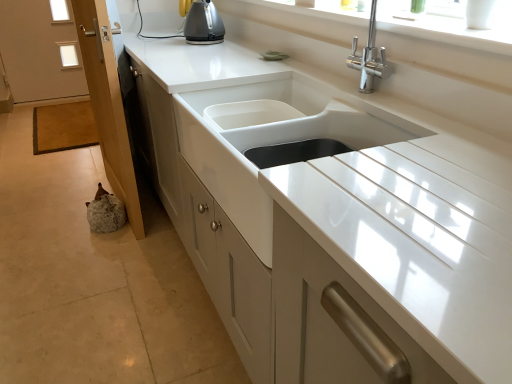
The height and width of the screenshot is (384, 512). What do you see at coordinates (108, 104) in the screenshot?
I see `wooden screen door at lower left` at bounding box center [108, 104].

Where is `wooden screen door at lower left`? The height and width of the screenshot is (384, 512). wooden screen door at lower left is located at coordinates (108, 104).

Describe the element at coordinates (270, 139) in the screenshot. I see `white glossy sink at center` at that location.

Locate an element on the screen. Image resolution: width=512 pixels, height=384 pixels. white glossy sink at center is located at coordinates (270, 139).

What is the approximate width of white glossy sink at center?

20.01 inches.

Image resolution: width=512 pixels, height=384 pixels. Identify the location of wooden screen door at lower left. coord(108,104).

Considering the positions of objects white glossy sink at center and wooden screen door at lower left in the image provided, who is more to the right, white glossy sink at center or wooden screen door at lower left?

white glossy sink at center is more to the right.

Does white glossy sink at center lie in front of wooden screen door at lower left?

Yes, white glossy sink at center is closer to the viewer.

Which point is more forward, (x=359, y=141) or (x=95, y=86)?

The point (x=359, y=141) is in front.

From the image's perspective, which is above, white glossy sink at center or wooden screen door at lower left?

wooden screen door at lower left is shown above in the image.

From a real-world perspective, who is located lower, white glossy sink at center or wooden screen door at lower left?

wooden screen door at lower left, from a real-world perspective.

Which object is wider, white glossy sink at center or wooden screen door at lower left?

white glossy sink at center is wider.

Can you confirm if white glossy sink at center is shorter than wooden screen door at lower left?

Correct, white glossy sink at center is not as tall as wooden screen door at lower left.

Considering the relative sizes of white glossy sink at center and wooden screen door at lower left in the image provided, is white glossy sink at center bigger than wooden screen door at lower left?

No, white glossy sink at center is not bigger than wooden screen door at lower left.

Is white glossy sink at center outside of wooden screen door at lower left?

Absolutely, white glossy sink at center is external to wooden screen door at lower left.

Is there a large distance between white glossy sink at center and wooden screen door at lower left?

That's not correct — white glossy sink at center is a little close to wooden screen door at lower left.

Is white glossy sink at center facing away from wooden screen door at lower left?

No.

How many degrees apart are the facing directions of white glossy sink at center and wooden screen door at lower left?

2.02 degrees separate the facing orientations of white glossy sink at center and wooden screen door at lower left.

The width and height of the screenshot is (512, 384). What are the coordinates of `sink that is on the right side of wooden screen door at lower left` in the screenshot? It's located at (270, 139).

Considering the relative positions of wooden screen door at lower left and white glossy sink at center in the image provided, is wooden screen door at lower left to the left or to the right of white glossy sink at center?

In the image, wooden screen door at lower left appears on the left side of white glossy sink at center.

Does wooden screen door at lower left come behind white glossy sink at center?

Yes, wooden screen door at lower left is behind white glossy sink at center.

Considering the positions of points (131, 170) and (252, 209), is point (131, 170) closer to camera compared to point (252, 209)?

No, (131, 170) is behind (252, 209).

From the image's perspective, does wooden screen door at lower left appear lower than white glossy sink at center?

No, from the image's perspective, wooden screen door at lower left is not below white glossy sink at center.

From a real-world perspective, is wooden screen door at lower left below white glossy sink at center?

Yes, from a real-world perspective, wooden screen door at lower left is below white glossy sink at center.

Considering the relative sizes of wooden screen door at lower left and white glossy sink at center in the image provided, is wooden screen door at lower left thinner than white glossy sink at center?

Yes, wooden screen door at lower left is thinner than white glossy sink at center.

Considering the sizes of wooden screen door at lower left and white glossy sink at center in the image, is wooden screen door at lower left taller or shorter than white glossy sink at center?

In the image, wooden screen door at lower left appears to be taller than white glossy sink at center.

Can you confirm if wooden screen door at lower left is smaller than white glossy sink at center?

Incorrect, wooden screen door at lower left is not smaller in size than white glossy sink at center.

Would you say wooden screen door at lower left is outside white glossy sink at center?

wooden screen door at lower left lies outside white glossy sink at center's area.

Is wooden screen door at lower left with white glossy sink at center?

They are not placed beside each other.

Could you tell me if wooden screen door at lower left is facing white glossy sink at center?

No, wooden screen door at lower left is not oriented towards white glossy sink at center.

How distant is wooden screen door at lower left from white glossy sink at center?

wooden screen door at lower left and white glossy sink at center are 34.12 inches apart from each other.

You are a GUI agent. You are given a task and a screenshot of the screen. Output one action in this format:
    pyautogui.click(x=<x>, y=<y>)
    Task: Click on the sink located above the wooden screen door at lower left (from a real-world perspective)
    
    Given the screenshot: What is the action you would take?
    pyautogui.click(x=270, y=139)

I want to click on screen door located on the left of white glossy sink at center, so click(x=108, y=104).

Find the location of `screen door above the white glossy sink at center (from the image's perspective)`. screen door above the white glossy sink at center (from the image's perspective) is located at coordinates (108, 104).